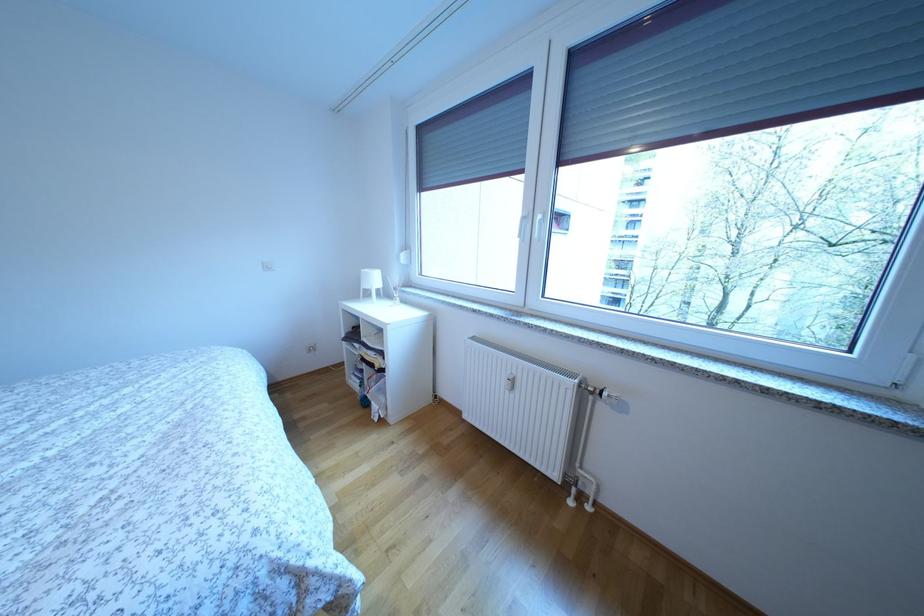
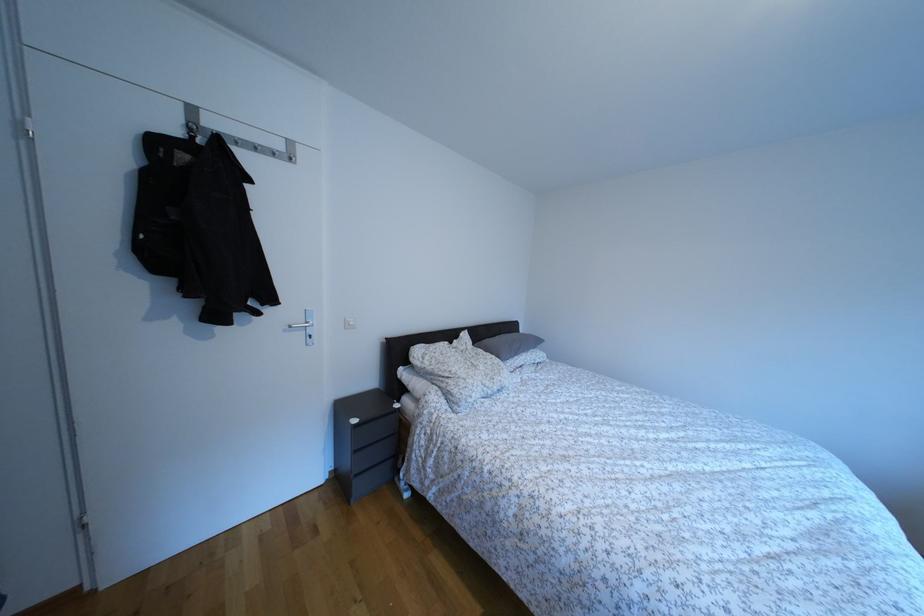
Question: The camera is either moving clockwise (left) or counter-clockwise (right) around the object. The first image is from the beginning of the video and the second image is from the end. Is the camera moving left or right when shooting the video?

Choices:
 (A) Left
 (B) Right

Answer: (B)